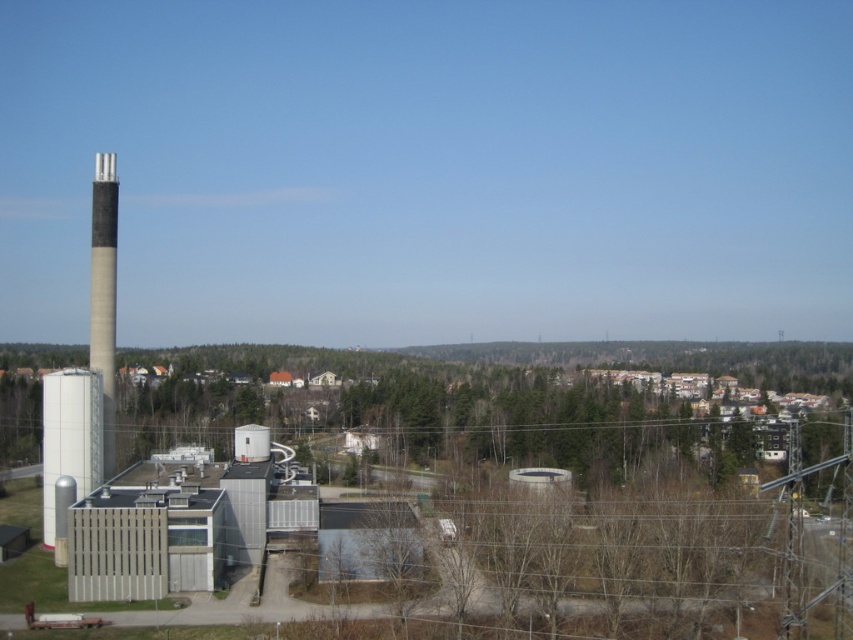
Does silver metallic building at center have a greater height compared to smooth concrete chimney at left?

In fact, silver metallic building at center may be shorter than smooth concrete chimney at left.

The width and height of the screenshot is (853, 640). What are the coordinates of `silver metallic building at center` in the screenshot? It's located at (186, 525).

This screenshot has width=853, height=640. What are the coordinates of `silver metallic building at center` in the screenshot? It's located at 186,525.

From the picture: Who is higher up, white matte water tower at lower left or smooth concrete chimney at left?

smooth concrete chimney at left

Locate an element on the screen. white matte water tower at lower left is located at coordinates (70, 436).

Between point (44, 445) and point (93, 244), which one is positioned in front?

Point (44, 445) is in front.

At what (x,y) coordinates should I click in order to perform the action: click on white matte water tower at lower left. Please return your answer as a coordinate pair (x, y). The height and width of the screenshot is (640, 853). Looking at the image, I should click on (70, 436).

Based on the photo, is silver metallic building at center to the right of white matte water tower at lower left from the viewer's perspective?

Indeed, silver metallic building at center is positioned on the right side of white matte water tower at lower left.

Is point (83, 528) in front of point (64, 445)?

Yes, point (83, 528) is closer to viewer.

This screenshot has height=640, width=853. In order to click on silver metallic building at center in this screenshot , I will do `click(186, 525)`.